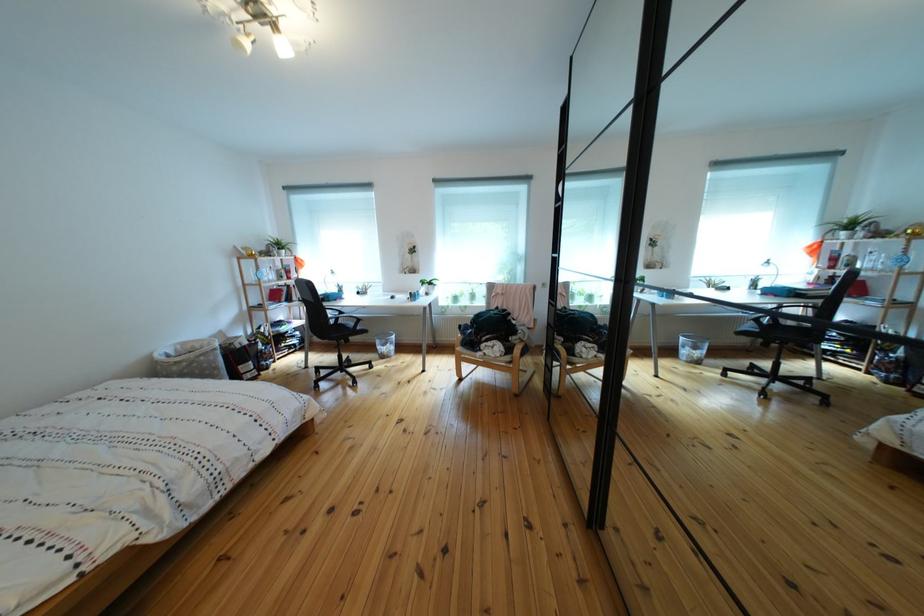
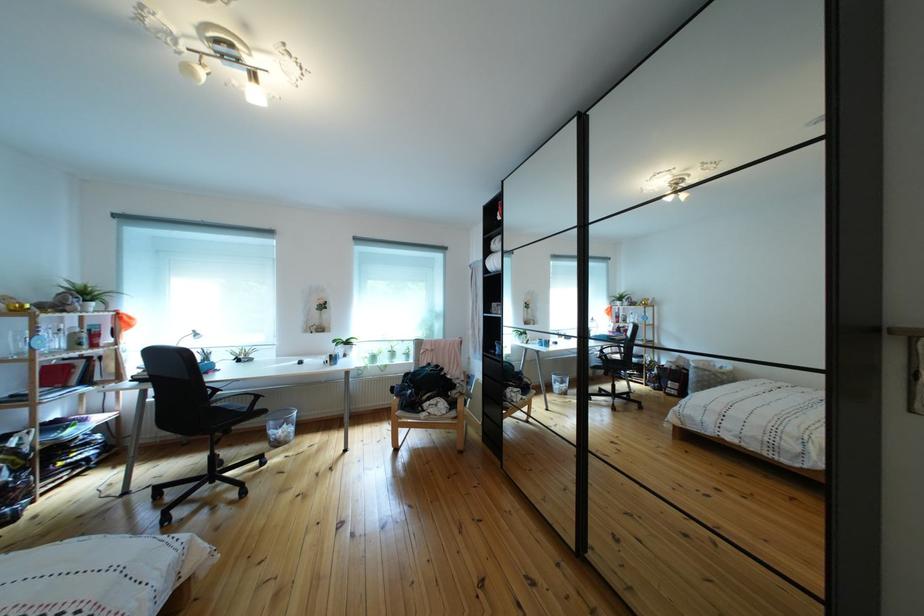
Where in the second image is the point corresponding to (353,318) from the first image?

(227, 395)